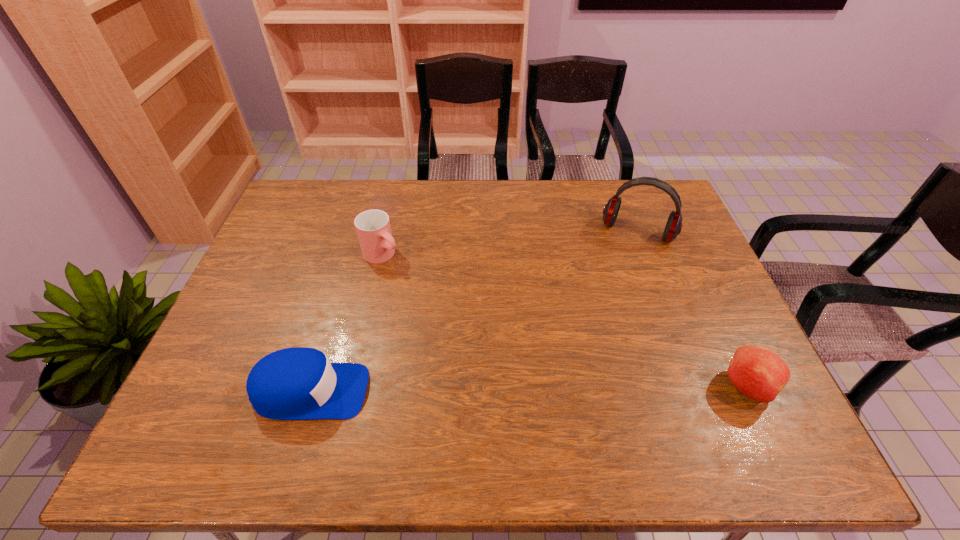
Identify the location of baseball cap. (298, 383).

This screenshot has height=540, width=960. In order to click on apple in this screenshot , I will do `click(758, 373)`.

This screenshot has width=960, height=540. I want to click on cup, so click(x=373, y=229).

Locate an element on the screen. The width and height of the screenshot is (960, 540). the tallest object is located at coordinates coord(673,227).

At what (x,y) coordinates should I click in order to perform the action: click on vacant space positioned 0.120m on the front-facing side of the baseball cap. Please return your answer as a coordinate pair (x, y). This screenshot has width=960, height=540. Looking at the image, I should click on (420, 392).

Where is `vacant space situated on the left of the apple`? vacant space situated on the left of the apple is located at coordinates (628, 387).

You are a GUI agent. You are given a task and a screenshot of the screen. Output one action in this format:
    pyautogui.click(x=<x>, y=<y>)
    Task: Click on the blank area located 0.380m on the side of the cup with the handle
    
    Given the screenshot: What is the action you would take?
    pyautogui.click(x=488, y=335)

Find the location of a particular element. The width and height of the screenshot is (960, 540). free space located on the side of the cup with the handle is located at coordinates (473, 324).

The height and width of the screenshot is (540, 960). I want to click on vacant space located 0.220m on the side of the cup with the handle, so click(x=445, y=302).

Find the location of `free point located on the ear cups of the earphone`. free point located on the ear cups of the earphone is located at coordinates (624, 258).